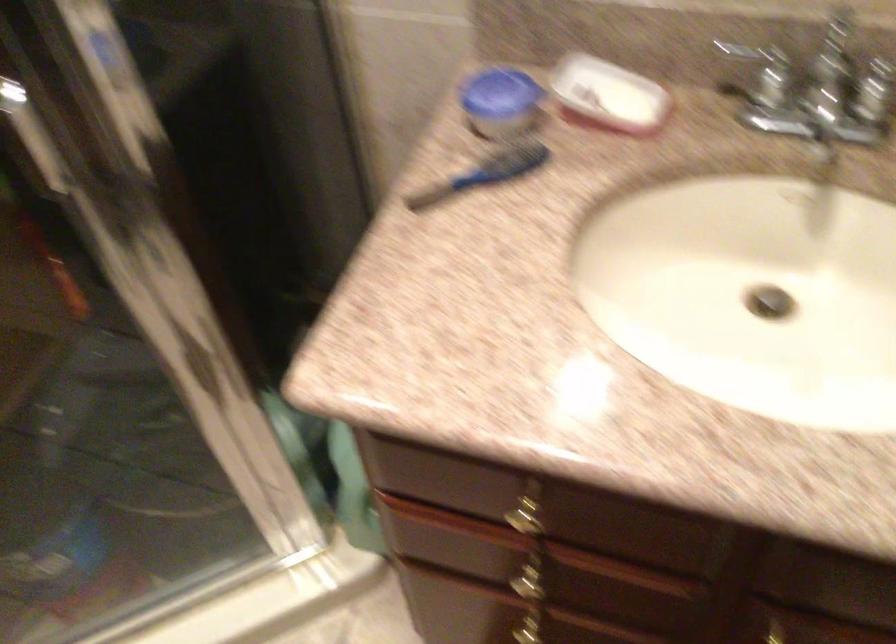
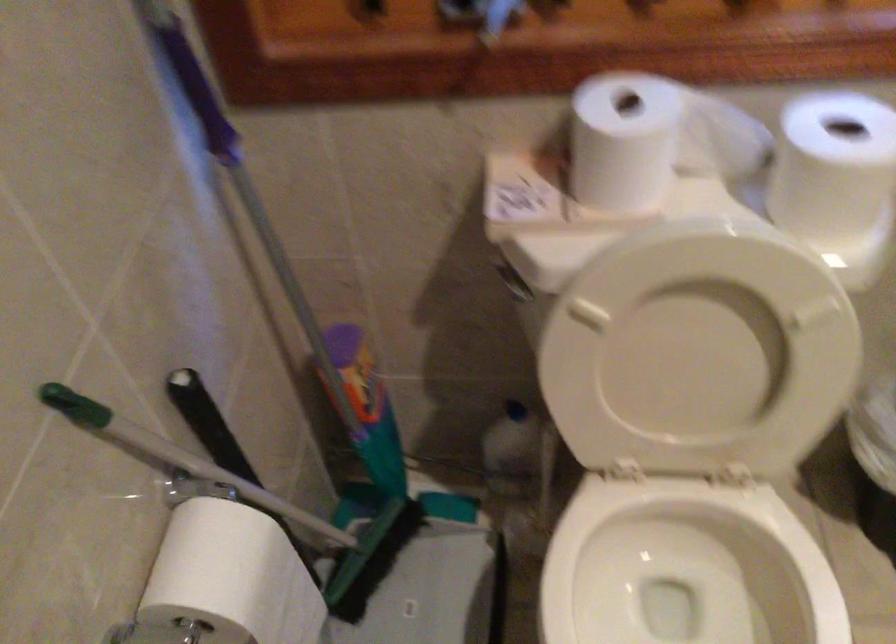
The images are taken continuously from a first-person perspective. In which direction is your viewpoint rotating?

The camera's rotation is toward left-down.